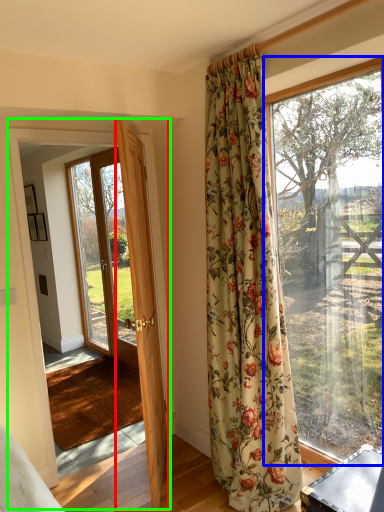
Question: Which object is positioned closest to door (highlighted by a red box)? Select from window (highlighted by a blue box) and barn door (highlighted by a green box).

Choices:
 (A) window
 (B) barn door

Answer: (B)